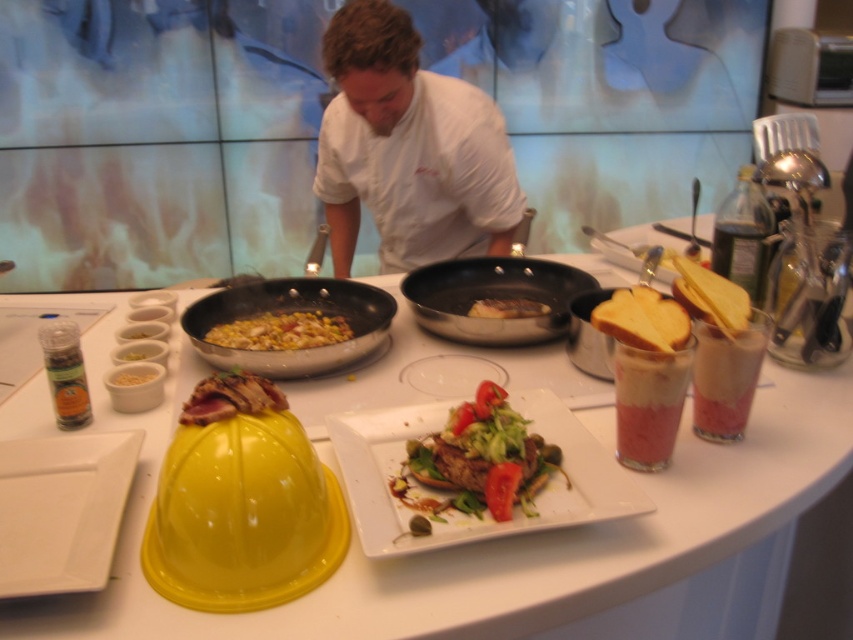
Is white glossy plate at center smaller than matte brown steak at center?

No, white glossy plate at center is not smaller than matte brown steak at center.

Is point (480, 536) positioned in front of point (444, 429)?

Yes, it is.

At what (x,y) coordinates should I click in order to perform the action: click on white glossy plate at center. Please return your answer as a coordinate pair (x, y). The image size is (853, 640). Looking at the image, I should click on (453, 492).

Who is taller, yellow plastic bowl at center or white matte plate at lower left?

yellow plastic bowl at center

Between yellow plastic bowl at center and white matte plate at lower left, which one appears on the left side from the viewer's perspective?

white matte plate at lower left is more to the left.

This screenshot has height=640, width=853. Describe the element at coordinates (494, 540) in the screenshot. I see `yellow plastic bowl at center` at that location.

Where is `yellow plastic bowl at center`? This screenshot has height=640, width=853. yellow plastic bowl at center is located at coordinates (494, 540).

Which of these two, shiny stainless steel wok at center or yellow glossy corn at center, stands taller?

shiny stainless steel wok at center is taller.

Looking at this image, between shiny stainless steel wok at center and yellow glossy corn at center, which one is positioned higher?

Positioned higher is shiny stainless steel wok at center.

Does point (250, 305) lie in front of point (326, 332)?

No, (250, 305) is further to viewer.

What are the coordinates of `shiny stainless steel wok at center` in the screenshot? It's located at (287, 312).